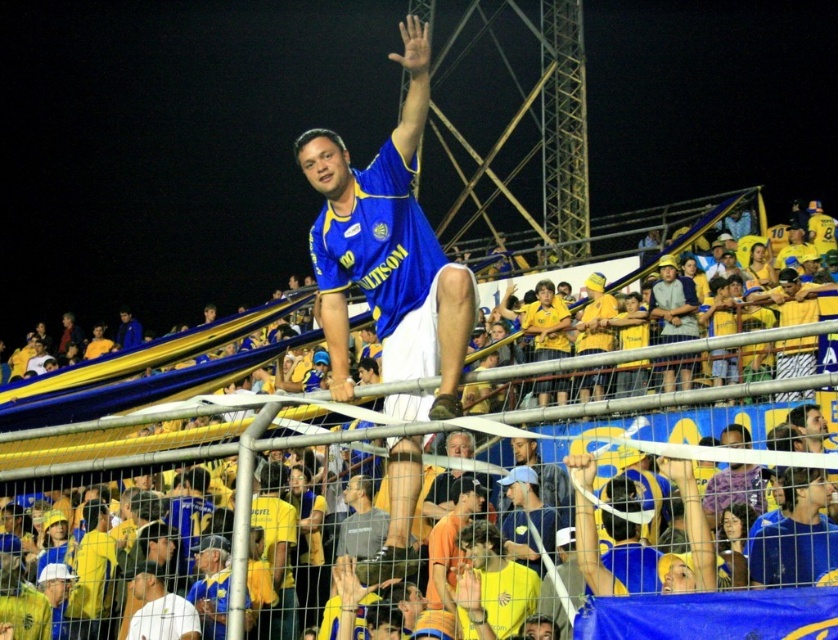
Can you confirm if blue jersey at center is thinner than yellow jersey at upper center?

Correct, blue jersey at center's width is less than yellow jersey at upper center's.

Can you confirm if blue jersey at center is smaller than yellow jersey at upper center?

Indeed, blue jersey at center has a smaller size compared to yellow jersey at upper center.

Who is more forward, [334,144] or [122,470]?

Positioned in front is point [122,470].

What are the coordinates of `blue jersey at center` in the screenshot? It's located at (388, 253).